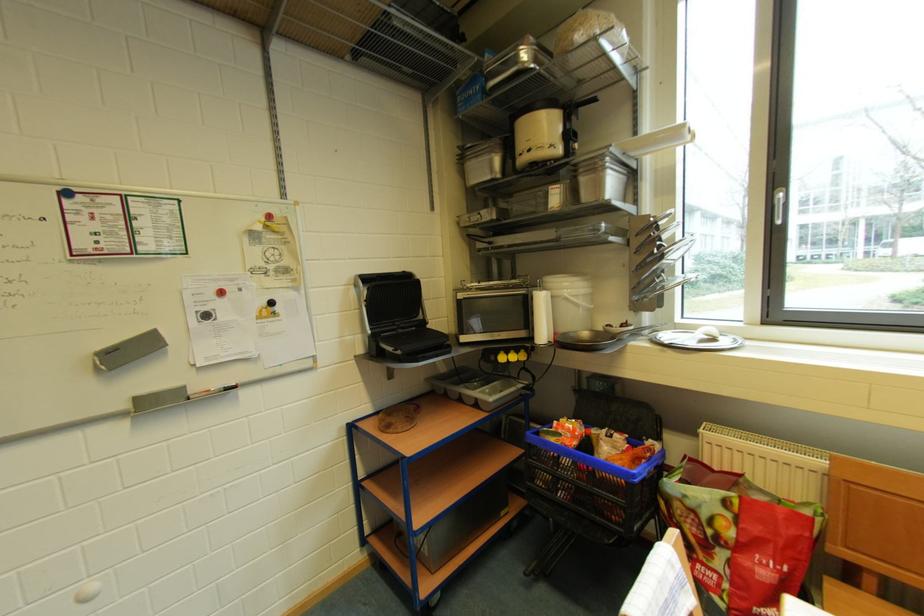
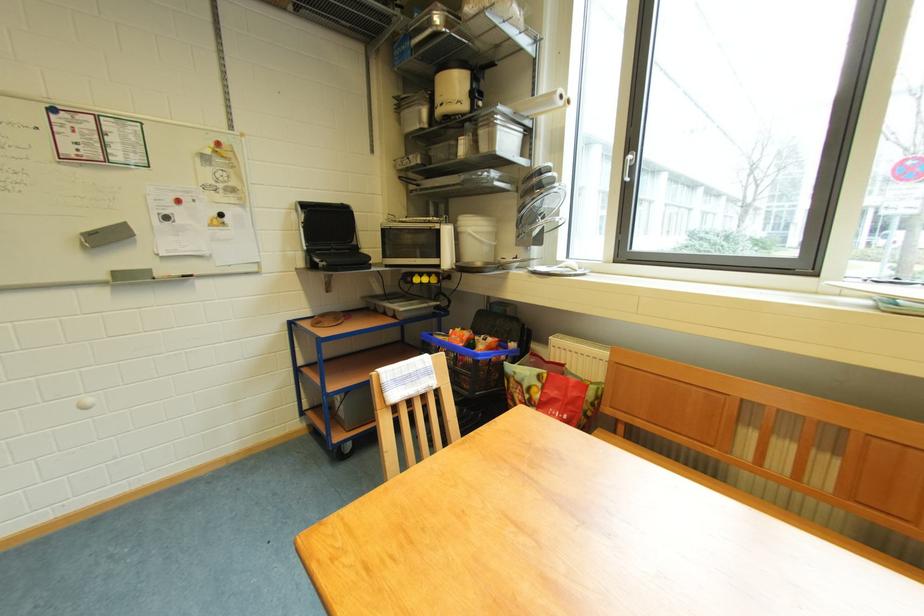
Question: I am providing you with two images of the same scene from different viewpoints. Which of the following objects are not visible in image2?

Choices:
 (A) white plate
 (B) black grill handle
 (C) paper towel roll
 (D) none of these

Answer: (D)